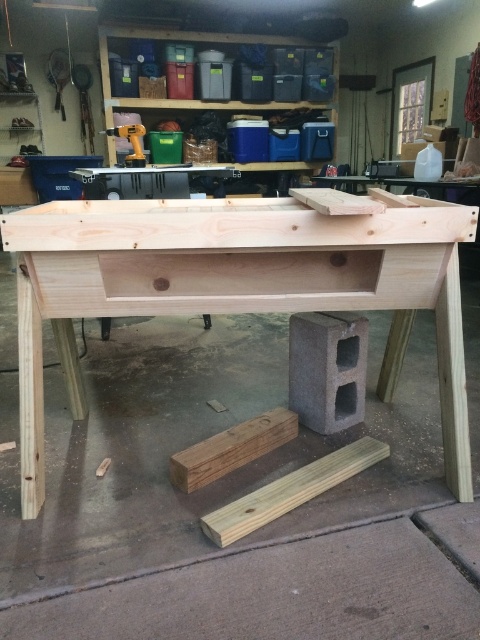
Looking at this image, you are standing in front of the natural wood table at center in the workshop. You want to place a 4 feet long tool on the table. Can you fit the tool on the table without it hanging off the edge?

The natural wood table at center is 3.78 feet away from the camera, but this distance does not indicate the table length. The question cannot be answered with the provided information.

You are a carpenter working on a wooden workbench. You have two pieces of wood on the surface. Which one is bigger in size between the light brown wood plank at lower center and the natural wood plank at center?

The light brown wood plank at lower center has a larger size compared to natural wood plank at center, so it is bigger.

You are organizing a woodworking project and need to place both the natural wood table at center and the light brown wood plank at lower center on a truck. The truck has a loading area that can only accommodate items up to 1.2 meters in width. Based on their widths, can both items fit side by side without exceeding the truck bed width?

The natural wood table at center might be wider than the light brown wood plank at lower center, so their combined width could exceed the truck bed limit of 1.2 meters. It is uncertain whether they can fit without more specific width measurements.